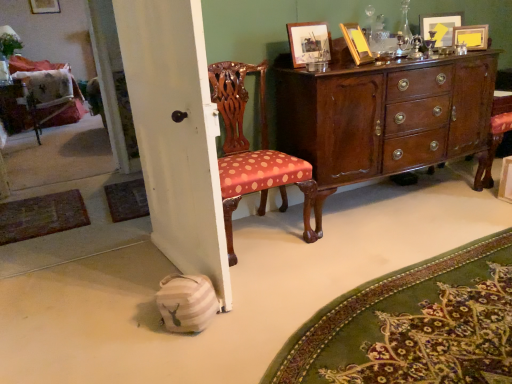
Question: Is matte wooden picture frame at upper center, acting as the 4th picture frame starting from the right, thinner than wooden picture frame at upper left, which is the first picture frame in left-to-right order?

Choices:
 (A) no
 (B) yes

Answer: (A)

Question: Does matte wooden picture frame at upper center, positioned as the 2th picture frame in front-to-back order, have a smaller size compared to wooden picture frame at upper left, the first picture frame positioned from the top?

Choices:
 (A) no
 (B) yes

Answer: (B)

Question: Is matte wooden picture frame at upper center, the fourth picture frame from the back, positioned before wooden picture frame at upper left, the 5th picture frame positioned from the right?

Choices:
 (A) yes
 (B) no

Answer: (A)

Question: Considering the relative positions of matte wooden picture frame at upper center, acting as the 4th picture frame starting from the right, and wooden picture frame at upper left, the 5th picture frame positioned from the right, in the image provided, is matte wooden picture frame at upper center, acting as the 4th picture frame starting from the right, to the right of wooden picture frame at upper left, the 5th picture frame positioned from the right, from the viewer's perspective?

Choices:
 (A) yes
 (B) no

Answer: (A)

Question: Is matte wooden picture frame at upper center, the fourth picture frame from the back, not inside wooden picture frame at upper left, the 5th picture frame positioned from the right?

Choices:
 (A) yes
 (B) no

Answer: (A)

Question: Does matte wooden picture frame at upper center, the 2th picture frame in the bottom-to-top sequence, have a lesser height compared to wooden picture frame at upper left, the 5th picture frame positioned from the right?

Choices:
 (A) no
 (B) yes

Answer: (B)

Question: Is wooden picture frame at upper right, marked as the first picture frame in a front-to-back arrangement, to the right of polished dark wood cabinet at center from the viewer's perspective?

Choices:
 (A) yes
 (B) no

Answer: (B)

Question: Is wooden picture frame at upper right, which is the fifth picture frame from top to bottom, completely or partially outside of polished dark wood cabinet at center?

Choices:
 (A) yes
 (B) no

Answer: (A)

Question: Is wooden picture frame at upper right, the 5th picture frame when ordered from back to front, wider than polished dark wood cabinet at center?

Choices:
 (A) yes
 (B) no

Answer: (B)

Question: Is wooden picture frame at upper right, marked as the first picture frame in a bottom-to-top arrangement, looking in the opposite direction of polished dark wood cabinet at center?

Choices:
 (A) yes
 (B) no

Answer: (B)

Question: From the image's perspective, is wooden picture frame at upper right, which is the 3th picture frame in left-to-right order, on polished dark wood cabinet at center?

Choices:
 (A) no
 (B) yes

Answer: (B)

Question: From a real-world perspective, is wooden picture frame at upper right, the 5th picture frame when ordered from back to front, beneath polished dark wood cabinet at center?

Choices:
 (A) yes
 (B) no

Answer: (B)

Question: From the image's perspective, is woven brown mat at lower left, which is the third mat from front to back, on beige woven mat at lower left, placed as the 1th mat when sorted from right to left?

Choices:
 (A) no
 (B) yes

Answer: (B)